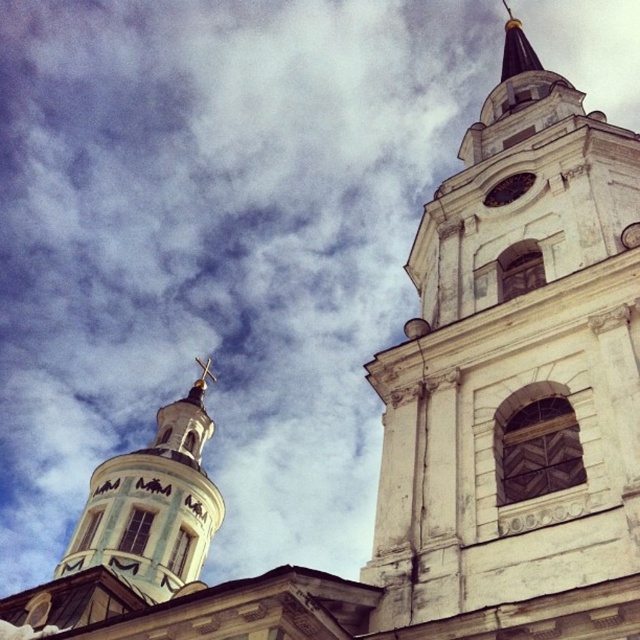
Is white painted wood tower at upper left thinner than matte white clock at upper center?

No, white painted wood tower at upper left is not thinner than matte white clock at upper center.

Between white painted wood tower at upper left and matte white clock at upper center, which one has more height?

With more height is white painted wood tower at upper left.

Between point (170, 465) and point (506, 196), which one is positioned behind?

Point (170, 465)

Identify the location of white painted wood tower at upper left. tap(152, 506).

Which is more to the left, white painted wood tower at upper left or gold-plated spire at upper right?

From the viewer's perspective, white painted wood tower at upper left appears more on the left side.

Which is behind, point (182, 429) or point (509, 32)?

Point (182, 429)

This screenshot has width=640, height=640. Identify the location of white painted wood tower at upper left. (152, 506).

This screenshot has width=640, height=640. I want to click on white painted wood tower at upper left, so click(x=152, y=506).

Which is more to the right, white stone tower at upper right or white painted wood tower at upper left?

Positioned to the right is white stone tower at upper right.

Does point (540, 122) come in front of point (204, 499)?

Yes, it is in front of point (204, 499).

I want to click on white stone tower at upper right, so (516, 384).